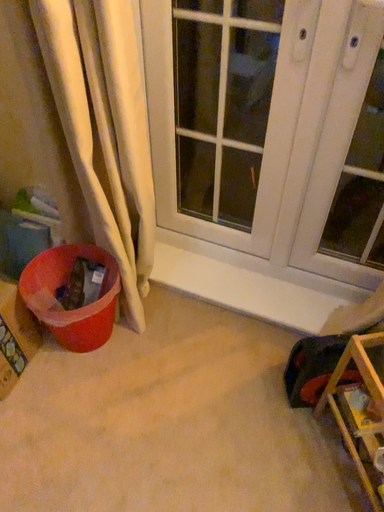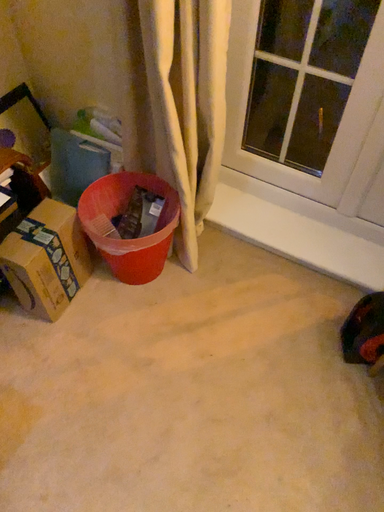
Question: Which way did the camera rotate in the video?

Choices:
 (A) rotated upward
 (B) rotated downward

Answer: (B)